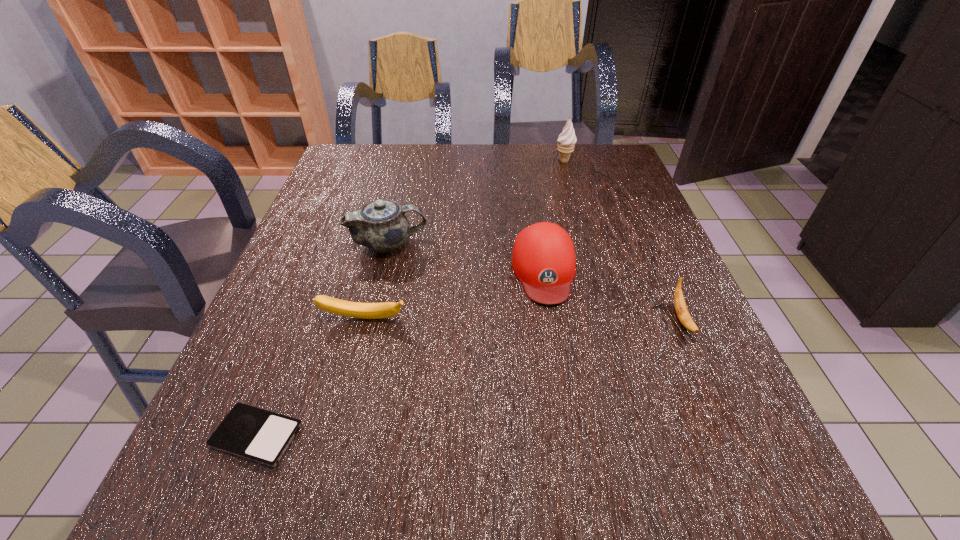
Locate an element on the screen. Image resolution: width=960 pixels, height=540 pixels. vacant space that's between the shortest object and the left banana is located at coordinates (310, 377).

Locate an element on the screen. The image size is (960, 540). object that ranks as the second closest to the right banana is located at coordinates (380, 225).

In order to click on object that stands as the third closest to the fourth object from left to right in this screenshot , I will do `click(333, 305)`.

Where is `free spot that satisfies the following two spatial constraints: 1. on the front-facing side of the fifth object from left to right; 2. at the stem of the left banana`? free spot that satisfies the following two spatial constraints: 1. on the front-facing side of the fifth object from left to right; 2. at the stem of the left banana is located at coordinates (609, 319).

Locate an element on the screen. The height and width of the screenshot is (540, 960). vacant position in the image that satisfies the following two spatial constraints: 1. on the front-facing side of the farthest object; 2. on the front-facing side of the fourth object from left to right is located at coordinates (595, 270).